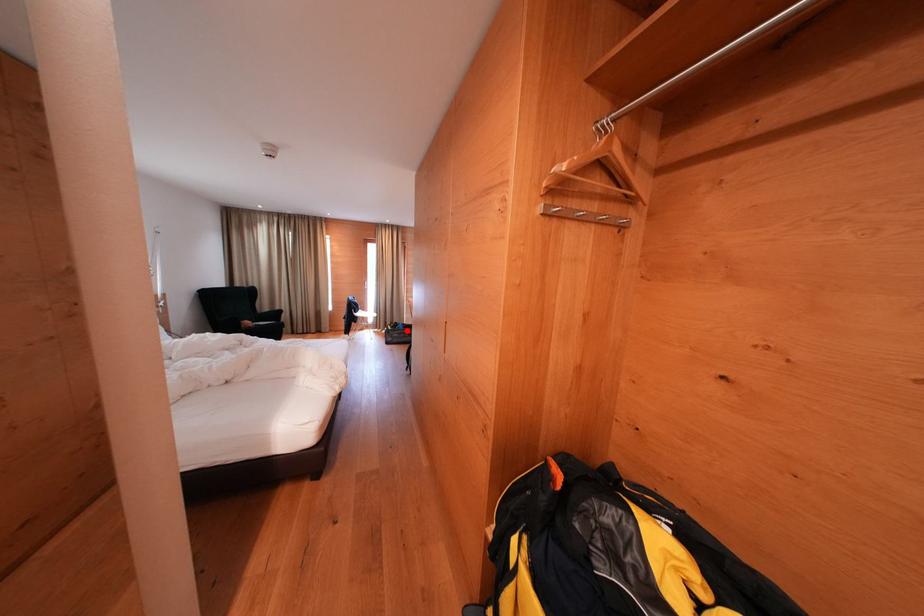
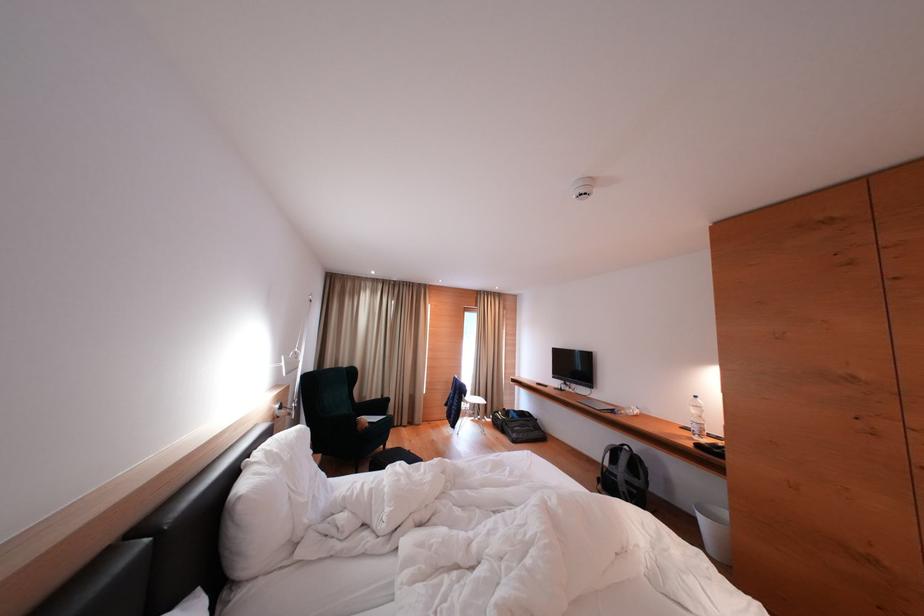
Locate, in the second image, the point that corresponds to the highlighted location in the first image.

(518, 418)